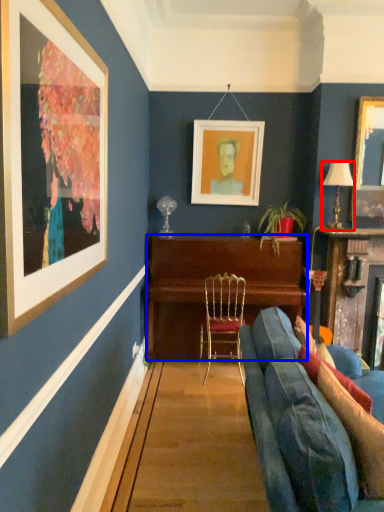
Question: Which point is closer to the camera, lamp (highlighted by a red box) or desk (highlighted by a blue box)?

Choices:
 (A) lamp
 (B) desk

Answer: (A)